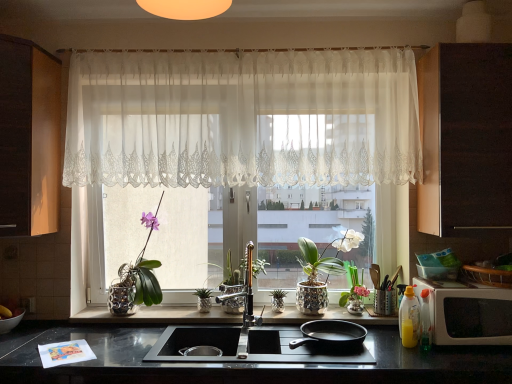
Question: Based on their sizes in the image, would you say dark wood cabinet at right, the 1th cabinetry from the right, is bigger or smaller than sheer white lace curtain at center?

Choices:
 (A) big
 (B) small

Answer: (B)

Question: Is point (475, 152) closer or farther from the camera than point (281, 129)?

Choices:
 (A) farther
 (B) closer

Answer: (B)

Question: Which object is the farthest from the metallic silver pot at center, positioned as the second plant in right-to-left order?

Choices:
 (A) black matte frying pan at center
 (B) pink glass vase at center, which is the first floral arrangement in right-to-left order
 (C) translucent plastic bottle at lower right
 (D) green metallic pineapple at center, marked as the second plant in a left-to-right arrangement
 (E) polished brass faucet at center

Answer: (C)

Question: Which of these objects is positioned farthest from the matte silver pot at center, the 1th floral arrangement viewed from the left?

Choices:
 (A) translucent plastic bottle at lower right
 (B) sheer white lace curtain at center
 (C) dark wood cabinet at right, the 1th cabinetry from the right
 (D) black matte frying pan at center
 (E) black granite countertop at lower center

Answer: (C)